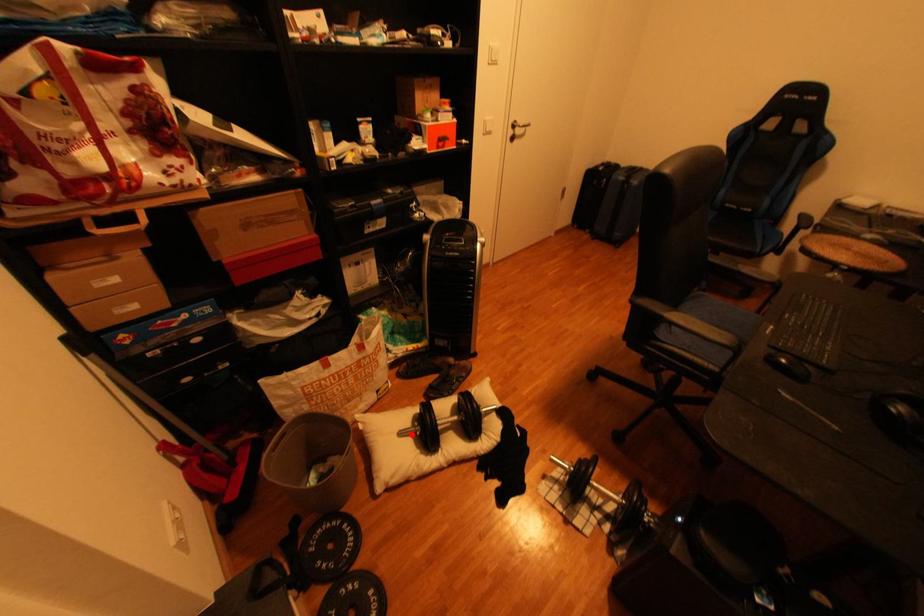
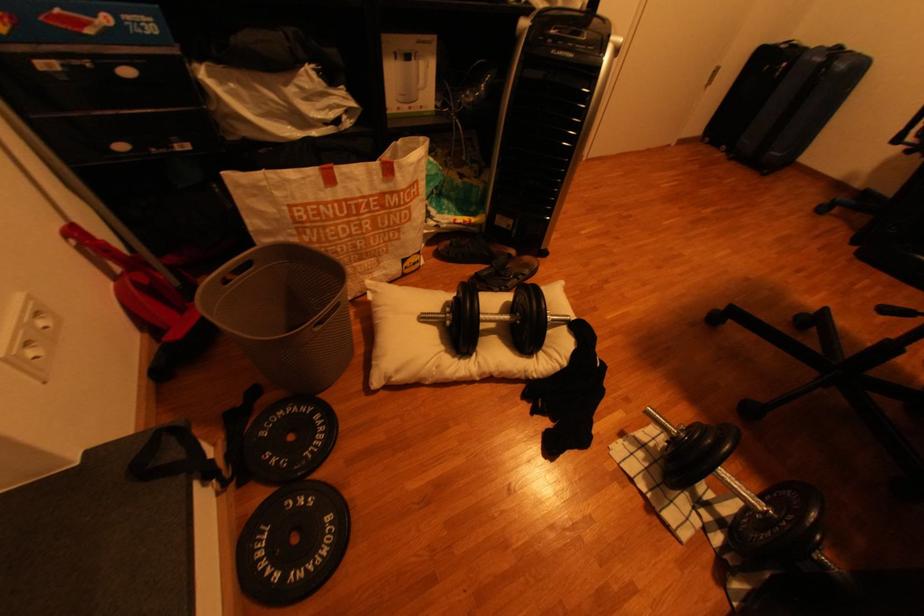
Question: A red point is marked in image1. In image2, is the corresponding 3D point closer to the camera or farther? Reply with the corresponding letter.

Choices:
 (A) The corresponding 3D point is closer.
 (B) The corresponding 3D point is farther.

Answer: (A)